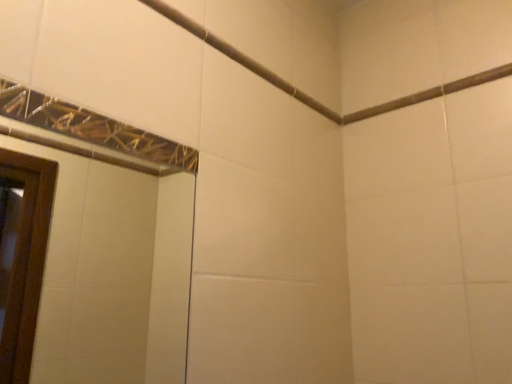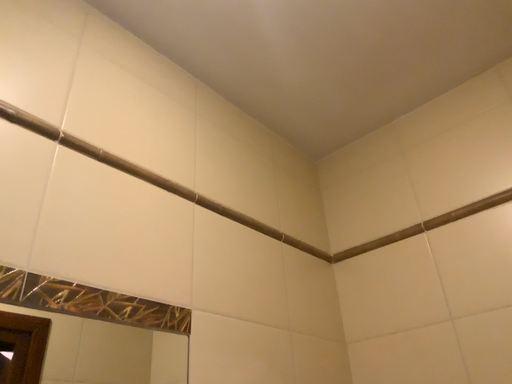
Question: How did the camera likely rotate when shooting the video?

Choices:
 (A) rotated downward
 (B) rotated upward

Answer: (B)